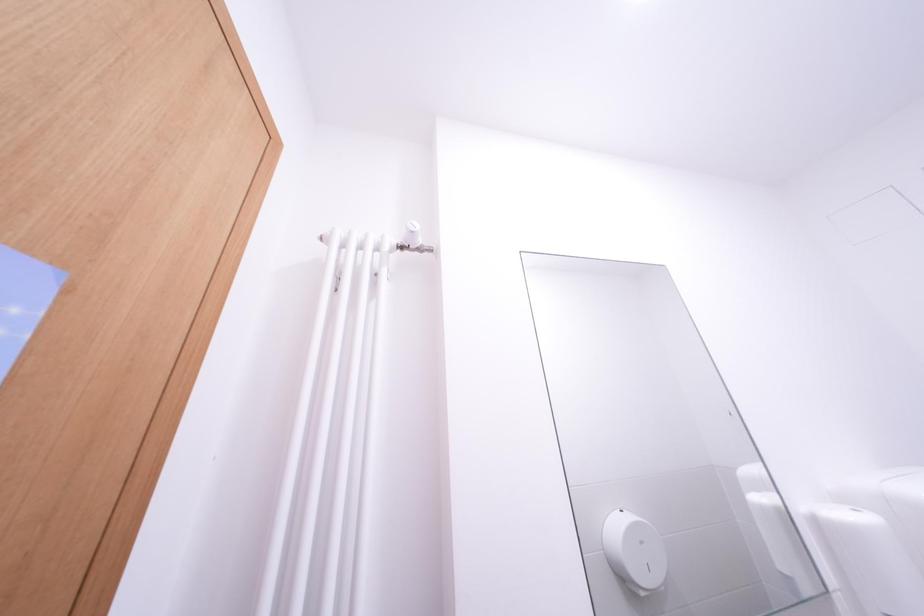
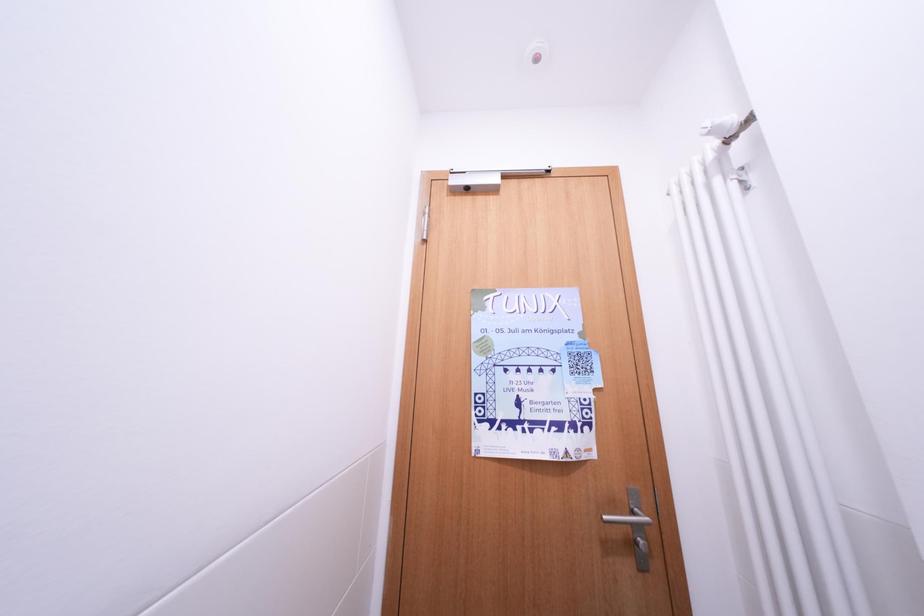
First-person continuous shooting, in which direction is the camera rotating?

The camera's rotation is toward left-up.